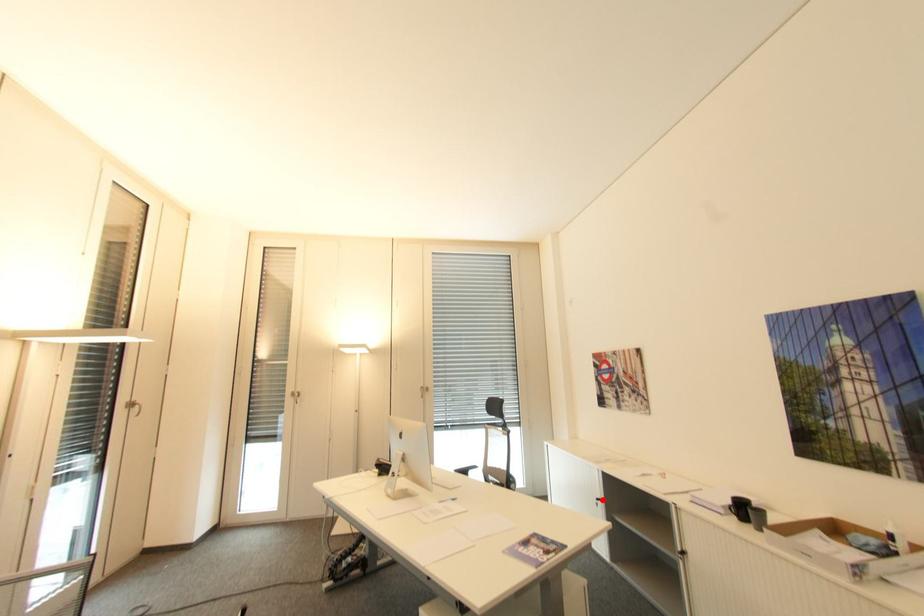
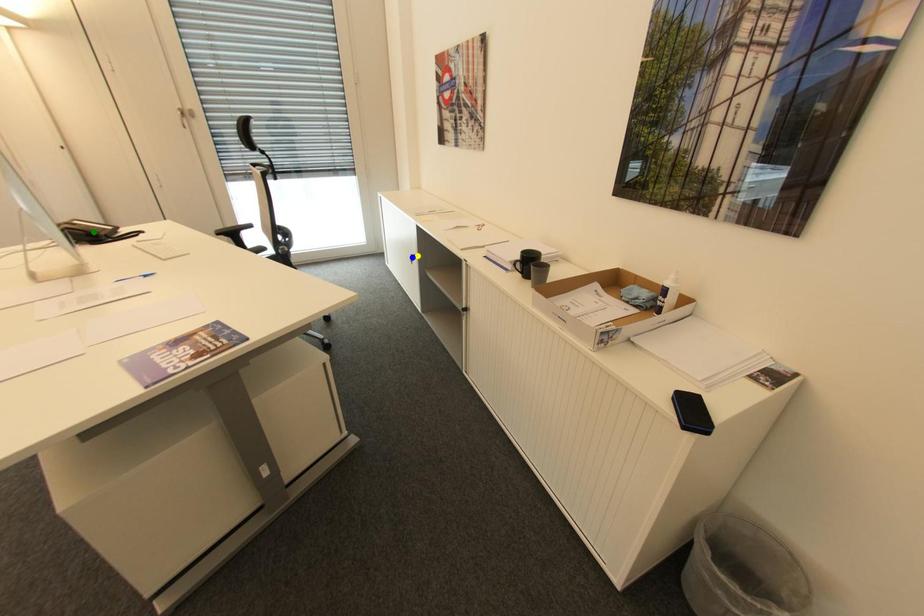
Question: I am providing you with two images of the same scene from different viewpoints. A red point is marked on the first image. You are given multiple points on the second image. Can you choose the point in image 2 that corresponds to the point in image 1?

Choices:
 (A) yellow point
 (B) green point
 (C) blue point

Answer: (A)